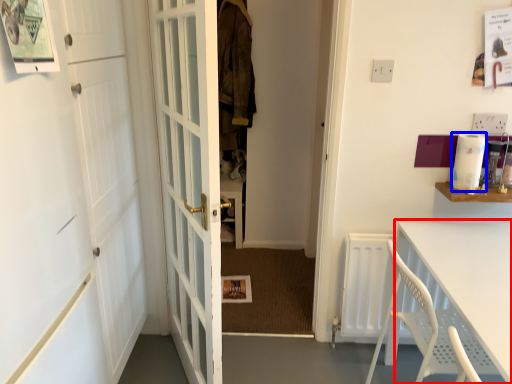
Question: Which object is closer to the camera taking this photo, table (highlighted by a red box) or appliance (highlighted by a blue box)?

Choices:
 (A) table
 (B) appliance

Answer: (A)